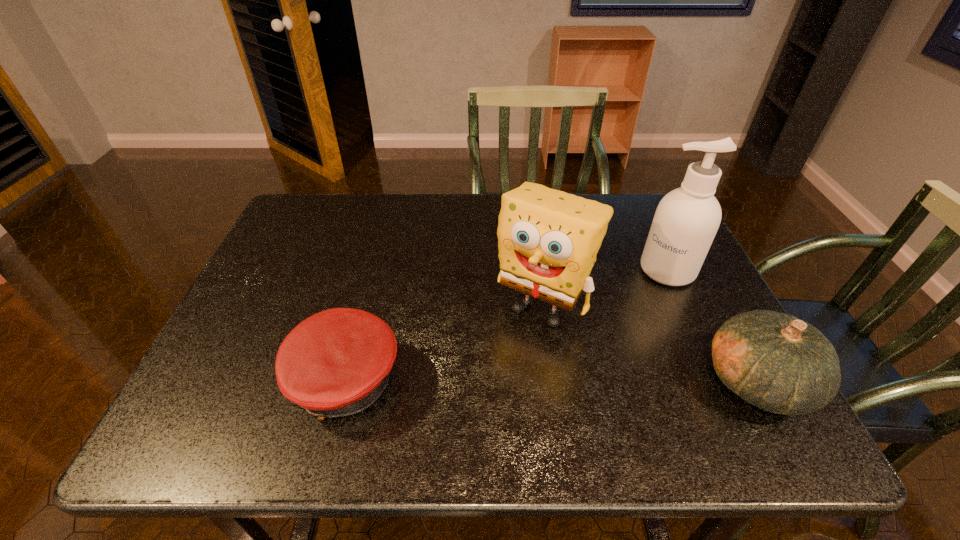
Identify the location of free space between the cap and the sponge. (443, 343).

The image size is (960, 540). I want to click on vacant space in between the tallest object and the sponge, so click(x=605, y=287).

At what (x,y) coordinates should I click in order to perform the action: click on vacant area that lies between the third object from right to left and the gourd. Please return your answer as a coordinate pair (x, y). Image resolution: width=960 pixels, height=540 pixels. Looking at the image, I should click on (650, 343).

You are a GUI agent. You are given a task and a screenshot of the screen. Output one action in this format:
    pyautogui.click(x=<x>, y=<y>)
    Task: Click on the free space between the cleansing agent and the third tallest object
    This screenshot has height=540, width=960.
    Given the screenshot: What is the action you would take?
    pyautogui.click(x=712, y=326)

This screenshot has width=960, height=540. Find the location of `vacant area that lies between the gourd and the sponge`. vacant area that lies between the gourd and the sponge is located at coordinates (650, 343).

What are the coordinates of `free space between the second shortest object and the tallest object` in the screenshot? It's located at (712, 326).

This screenshot has height=540, width=960. Identify the location of empty space that is in between the gourd and the shortest object. (550, 382).

The width and height of the screenshot is (960, 540). I want to click on vacant area that lies between the sponge and the shortest object, so click(443, 343).

Locate which object is the closest to the gourd. Please provide its 2D coordinates. Your answer should be formatted as a tuple, i.e. [(x, y)], where the tuple contains the x and y coordinates of a point satisfying the conditions above.

[(686, 220)]

You are a GUI agent. You are given a task and a screenshot of the screen. Output one action in this format:
    pyautogui.click(x=<x>, y=<y>)
    Task: Click on the closest object to the cap
    
    Given the screenshot: What is the action you would take?
    pyautogui.click(x=548, y=240)